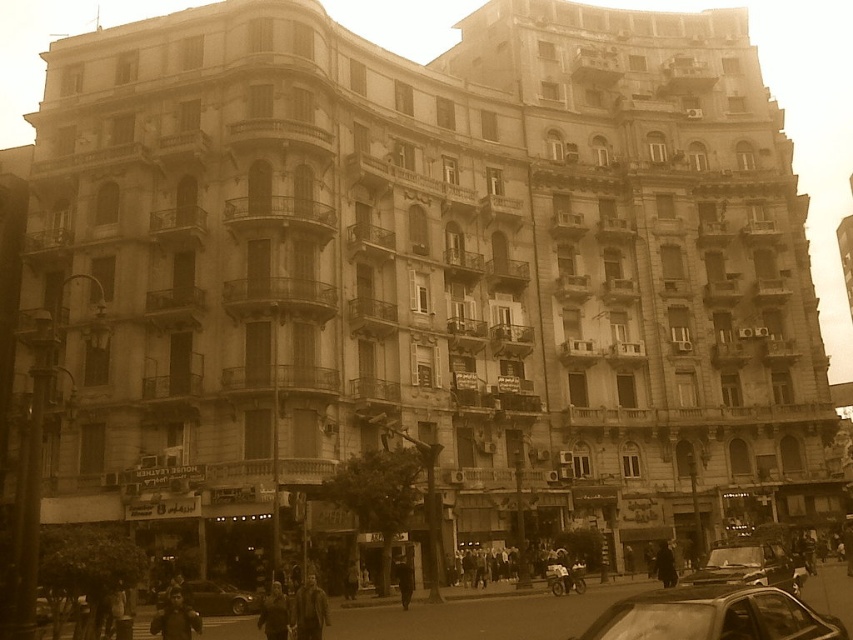
You are a delivery person trying to park your vehicle in a tight space between the metallic silver car at lower right and the metallic car at center. Considering their heights, which car should you position your vehicle closer to in order to maximize vertical clearance?

The metallic silver car at lower right has a greater height compared to the metallic car at center, so positioning your vehicle closer to the metallic car at center would provide more vertical clearance.

You are a delivery person needing to park your motorcycle between the metallic car at center and the metallic silver car at center. Is there enough space between them for your motorcycle, which is 2 meters long?

The metallic car at center and metallic silver car at center are 27.61 meters apart from each other, so yes, there is enough space between them for your motorcycle, which is 2 meters long.

You are standing in the middle of the street in front of the classical building. You see two points marked in the image. The first point is at coordinates point (758, 579) and the second point is at point (200, 609). Which point is closer to you?

Point (758, 579) is closer to the camera than point (200, 609).